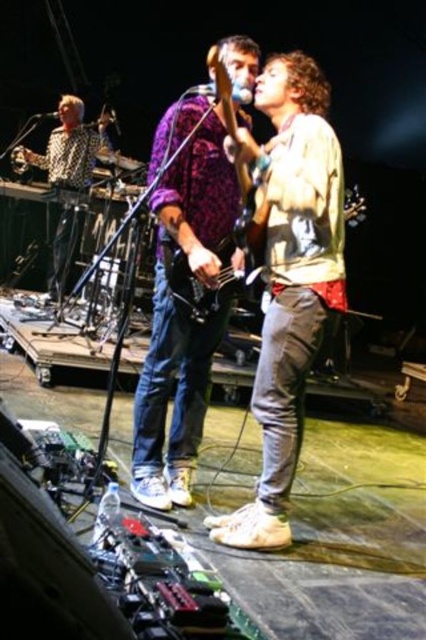
Can you confirm if purple textured shirt at center is positioned above metallic silver microphone at center?

Incorrect, purple textured shirt at center is not positioned above metallic silver microphone at center.

Is purple textured shirt at center positioned before metallic silver microphone at center?

Yes, purple textured shirt at center is in front of metallic silver microphone at center.

Locate an element on the screen. Image resolution: width=426 pixels, height=640 pixels. purple textured shirt at center is located at coordinates (183, 317).

Locate an element on the screen. Image resolution: width=426 pixels, height=640 pixels. purple textured shirt at center is located at coordinates (183, 317).

Can you confirm if brushed metal keyboard at left is positioned above shiny purple guitar at center?

Indeed, brushed metal keyboard at left is positioned over shiny purple guitar at center.

Can you confirm if brushed metal keyboard at left is positioned to the left of shiny purple guitar at center?

Yes, brushed metal keyboard at left is to the left of shiny purple guitar at center.

At what (x,y) coordinates should I click in order to perform the action: click on brushed metal keyboard at left. Please return your answer as a coordinate pair (x, y). This screenshot has width=426, height=640. Looking at the image, I should click on click(x=71, y=147).

Does purple textured shirt at center appear on the left side of metallic silver microphone at upper center?

In fact, purple textured shirt at center is to the right of metallic silver microphone at upper center.

Can you confirm if purple textured shirt at center is bigger than metallic silver microphone at upper center?

Yes, purple textured shirt at center is bigger than metallic silver microphone at upper center.

In order to click on purple textured shirt at center in this screenshot , I will do `click(183, 317)`.